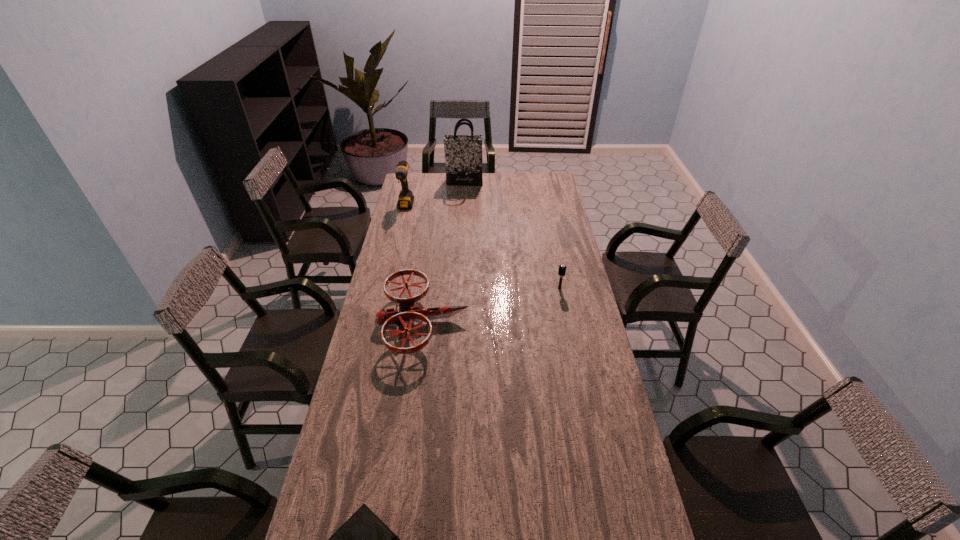
Locate an element on the screen. The height and width of the screenshot is (540, 960). vacant point located between the shopping bag and the drill is located at coordinates (435, 194).

Identify the location of free spot between the drill and the rightmost object. This screenshot has width=960, height=540. (483, 248).

Find the location of a particular element. free spot between the shopping bag and the rightmost object is located at coordinates (512, 235).

This screenshot has width=960, height=540. In order to click on vacant region between the shopping bag and the second shortest object in this screenshot , I will do `click(444, 253)`.

Identify the location of vacant region between the second shortest object and the drill. (415, 265).

The height and width of the screenshot is (540, 960). Identify the location of the third closest object relative to the third tallest object. (x=463, y=153).

Locate an element on the screen. The height and width of the screenshot is (540, 960). object identified as the fourth closest to the second farthest object is located at coordinates (363, 539).

Locate an element on the screen. vacant space that satisfies the following two spatial constraints: 1. on the front of the rightmost object with the design; 2. on the right side of the shopping bag is located at coordinates (459, 288).

Locate an element on the screen. The height and width of the screenshot is (540, 960). free spot that satisfies the following two spatial constraints: 1. with the drill bit of the drill facing forward; 2. on the right side of the hairbrush is located at coordinates pyautogui.click(x=386, y=288).

Where is `free space that satisfies the following two spatial constraints: 1. with the drill bit of the third tallest object facing forward; 2. on the left side of the drill`? Image resolution: width=960 pixels, height=540 pixels. free space that satisfies the following two spatial constraints: 1. with the drill bit of the third tallest object facing forward; 2. on the left side of the drill is located at coordinates (386, 288).